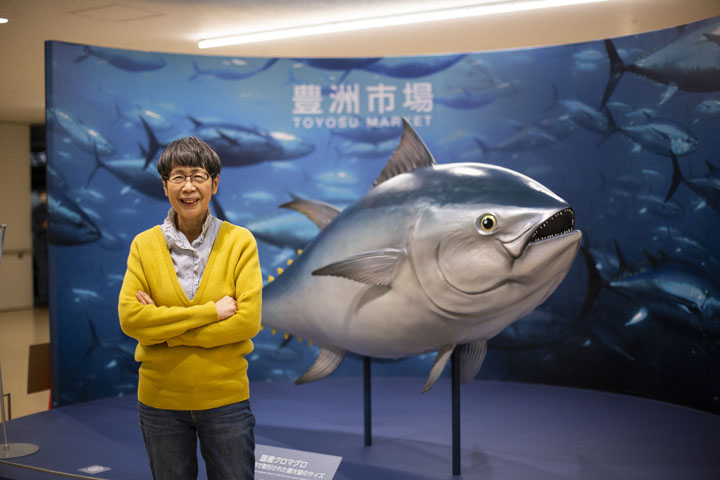
What are the coordinates of `floor sign in chinese` in the screenshot? It's located at (276, 464).